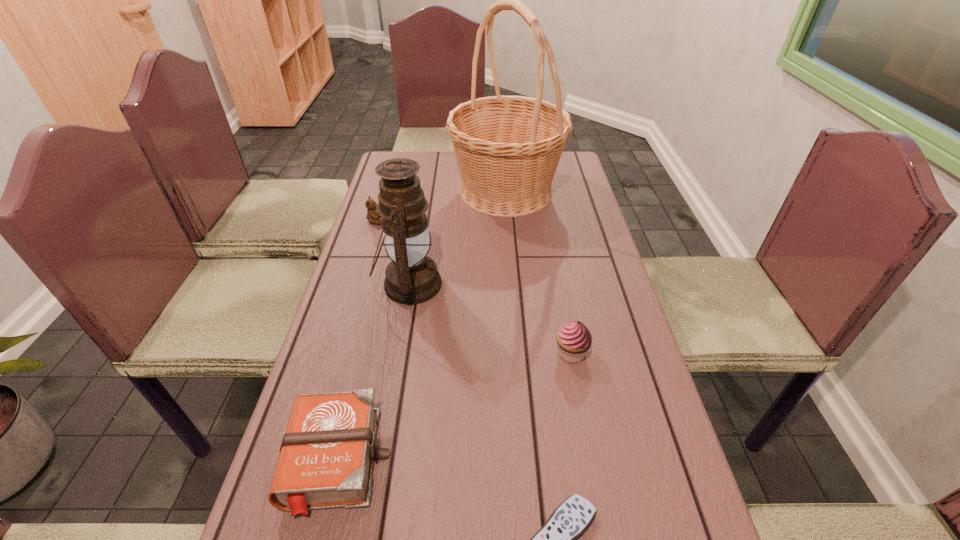
Find the location of a particular element. The width and height of the screenshot is (960, 540). free space at the left edge of the desktop is located at coordinates (390, 333).

In the image, there is a desktop. What are the coordinates of `vacant region at the right edge` in the screenshot? It's located at (591, 215).

Where is `free space at the far right corner of the desktop`? free space at the far right corner of the desktop is located at coordinates (556, 176).

Identify the location of empty space that is in between the third farthest object and the Bible. The height and width of the screenshot is (540, 960). (374, 373).

You are a GUI agent. You are given a task and a screenshot of the screen. Output one action in this format:
    pyautogui.click(x=<x>, y=<y>)
    Task: Click on the free space between the Bible and the third nearest object
    The width and height of the screenshot is (960, 540).
    Given the screenshot: What is the action you would take?
    pos(455,407)

I want to click on vacant area that lies between the basket and the teddy bear, so click(x=441, y=206).

You are a GUI agent. You are given a task and a screenshot of the screen. Output one action in this format:
    pyautogui.click(x=<x>, y=<y>)
    Task: Click on the vacant region between the tallest object and the Bible
    
    Given the screenshot: What is the action you would take?
    pyautogui.click(x=422, y=326)

What are the coordinates of `empty space between the third tallest object and the teddy bear` in the screenshot? It's located at (473, 287).

At what (x,y) coordinates should I click in order to perform the action: click on object identified as the second closest to the teddy bear. Please return your answer as a coordinate pair (x, y). Looking at the image, I should click on (508, 148).

Where is `object that can be found as the third closest to the shortest object`? The height and width of the screenshot is (540, 960). object that can be found as the third closest to the shortest object is located at coordinates (411, 278).